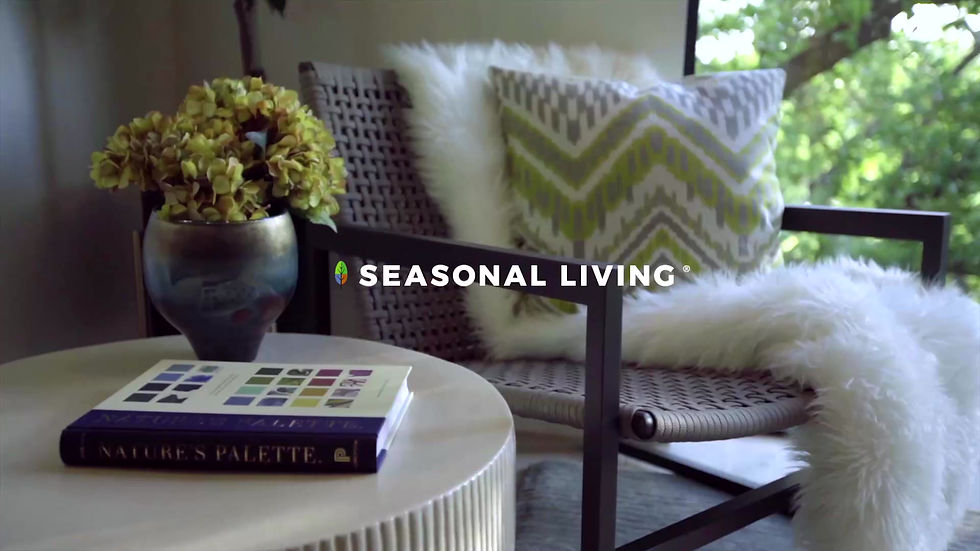
I want to click on plant, so click(254, 140).